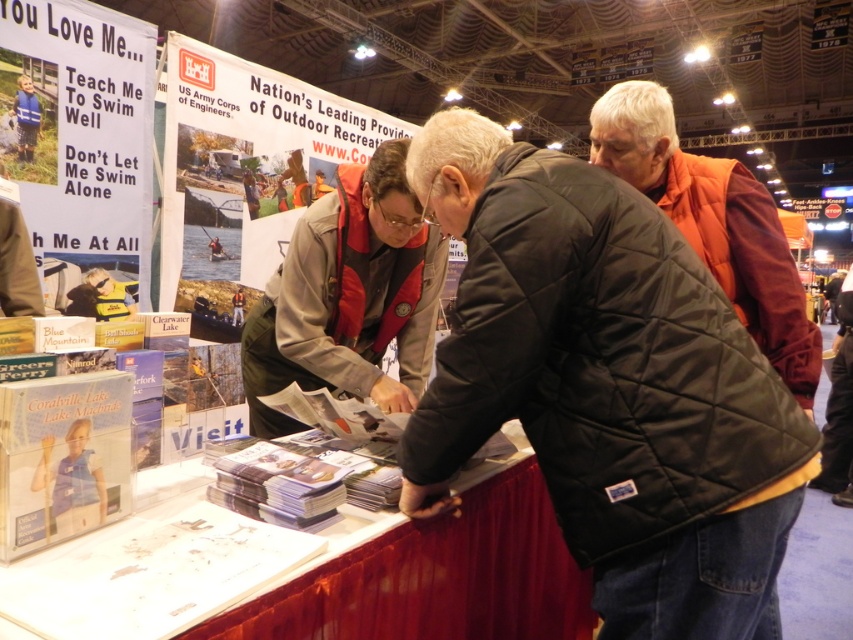
Question: Is black quilted vest at center in front of orange quilted vest at center?

Choices:
 (A) no
 (B) yes

Answer: (B)

Question: Considering the real-world distances, which object is farthest from the black quilted vest at center?

Choices:
 (A) orange quilted vest at center
 (B) khaki uniform at center

Answer: (A)

Question: Which point is farther to the camera?

Choices:
 (A) khaki uniform at center
 (B) black quilted vest at center

Answer: (A)

Question: Does black quilted vest at center appear under khaki uniform at center?

Choices:
 (A) yes
 (B) no

Answer: (A)

Question: Can you confirm if khaki uniform at center is positioned to the left of orange quilted vest at center?

Choices:
 (A) no
 (B) yes

Answer: (B)

Question: Which of the following is the closest to the observer?

Choices:
 (A) (450, 387)
 (B) (677, 154)

Answer: (A)